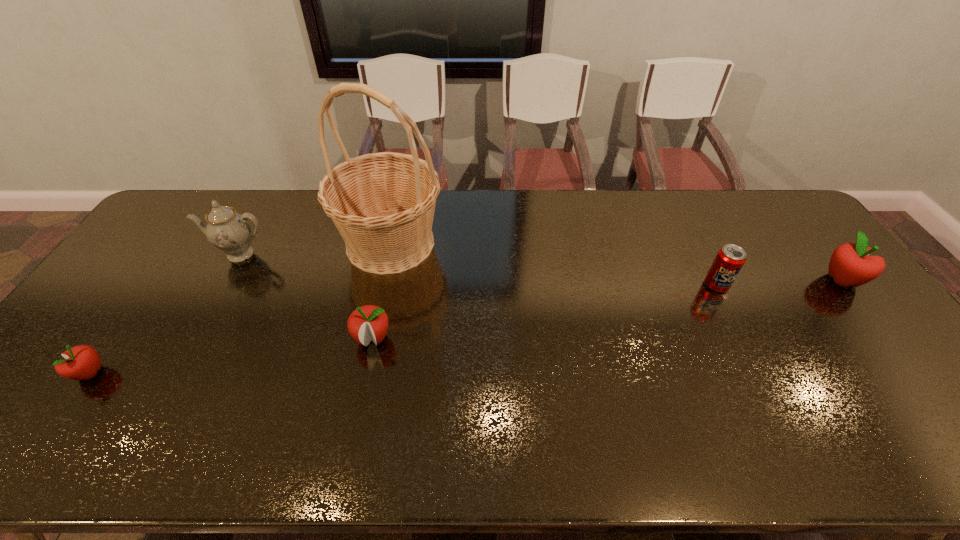
Where is `free space between the second object from left to right and the rightmost object`? Image resolution: width=960 pixels, height=540 pixels. free space between the second object from left to right and the rightmost object is located at coordinates (540, 267).

At what (x,y) coordinates should I click in order to perform the action: click on unoccupied position between the tallest object and the farthest apple. Please return your answer as a coordinate pair (x, y). This screenshot has width=960, height=540. Looking at the image, I should click on (616, 262).

Identify the location of vacant area between the rightmost apple and the tallest object. This screenshot has width=960, height=540. (616, 262).

Where is `free space between the nearest apple and the rightmost object`? free space between the nearest apple and the rightmost object is located at coordinates (467, 327).

You are a GUI agent. You are given a task and a screenshot of the screen. Output one action in this format:
    pyautogui.click(x=<x>, y=<y>)
    Task: Click on the vacant area between the second object from right to left and the tallest apple
    The image size is (960, 540).
    Given the screenshot: What is the action you would take?
    pyautogui.click(x=779, y=282)

Identify the location of vacant space that is in between the soda can and the tallest object. (553, 264).

Image resolution: width=960 pixels, height=540 pixels. Find the location of `object that is the third closest to the basket`. object that is the third closest to the basket is located at coordinates [82, 362].

You are a GUI agent. You are given a task and a screenshot of the screen. Output one action in this format:
    pyautogui.click(x=<x>, y=<y>)
    Task: Click on the second closest object relative to the fifth shortest object
    This screenshot has height=540, width=960.
    Given the screenshot: What is the action you would take?
    pyautogui.click(x=82, y=362)

You are a GUI agent. You are given a task and a screenshot of the screen. Output one action in this format:
    pyautogui.click(x=<x>, y=<y>)
    Task: Click on the apple that stands as the third closest to the basket
    
    Given the screenshot: What is the action you would take?
    (850, 265)

Identify the location of the third closest apple to the second object from left to right. This screenshot has width=960, height=540. (850, 265).